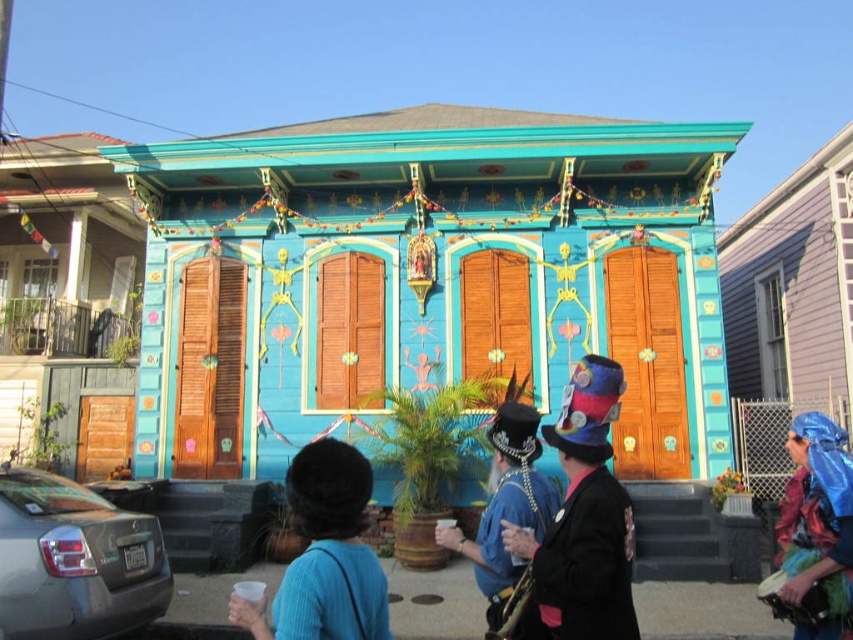
Is velvet multicolored hat at center positioned behind blue velvet hat at center?

No, it is in front of blue velvet hat at center.

Which of these two, velvet multicolored hat at center or blue velvet hat at center, stands taller?

With more height is velvet multicolored hat at center.

Is point (537, 563) more distant than point (538, 438)?

That is False.

In order to click on velvet multicolored hat at center in this screenshot , I will do `click(584, 518)`.

Can you confirm if velvet multicolored hat at center is bigger than blue fabric hat at center?

Correct, velvet multicolored hat at center is larger in size than blue fabric hat at center.

Is point (602, 547) positioned behind point (322, 477)?

Yes, it is.

At what (x,y) coordinates should I click in order to perform the action: click on velvet multicolored hat at center. Please return your answer as a coordinate pair (x, y). Looking at the image, I should click on (584, 518).

Between blue fabric hat at center and blue shiny fabric at lower right, which one is positioned higher?

blue fabric hat at center is higher up.

Is blue fabric hat at center behind blue shiny fabric at lower right?

No, it is not.

Who is more distant from viewer, (323, 621) or (844, 540)?

Positioned behind is point (844, 540).

Locate an element on the screen. The height and width of the screenshot is (640, 853). blue fabric hat at center is located at coordinates (325, 554).